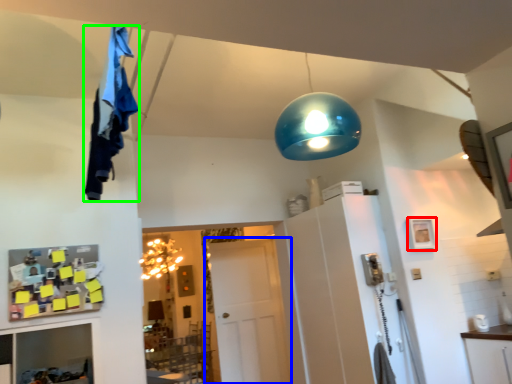
Question: Which object is the closest to the picture frame (highlighted by a red box)? Choose among these: door (highlighted by a blue box) or laundry (highlighted by a green box).

Choices:
 (A) door
 (B) laundry

Answer: (A)